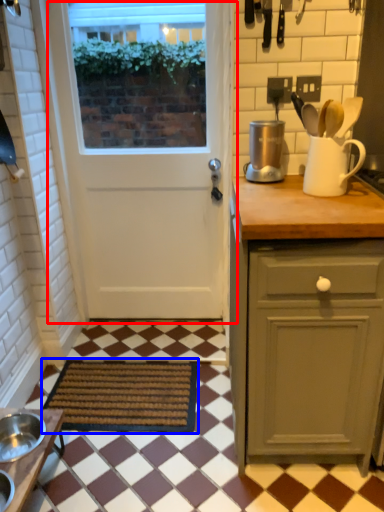
Question: Which object appears closest to the camera in this image, door (highlighted by a red box) or mat (highlighted by a blue box)?

Choices:
 (A) door
 (B) mat

Answer: (B)